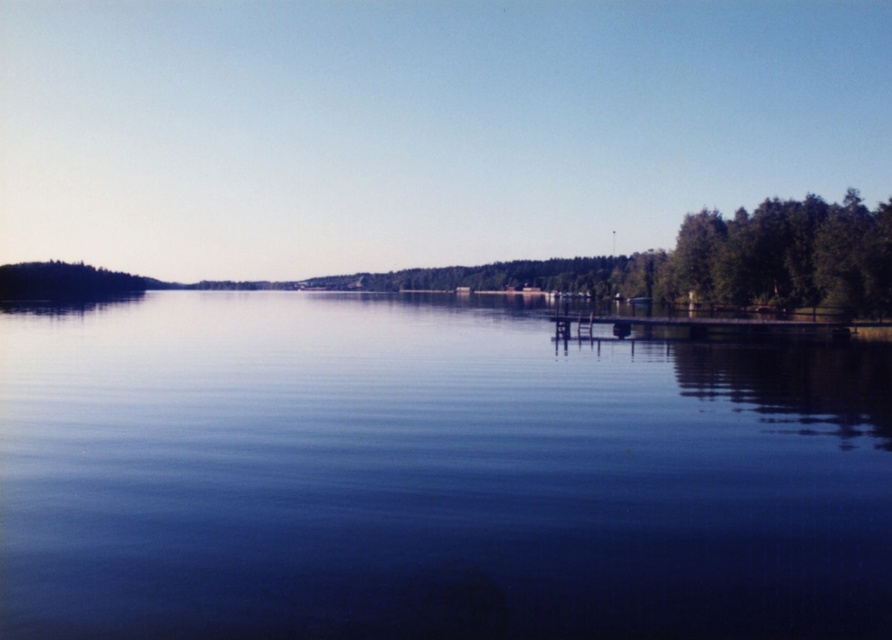
In the scene shown: You are a drone operator trying to capture the reflection of the wooden dock on the blue smooth water at center. According to the coordinates provided, where should you position the drone to best capture this reflection?

The blue smooth water at center is located at point (430, 476), so the drone should be positioned above that coordinate to capture the reflection of the wooden dock on the blue smooth water at center.

You are a kayaker planning to paddle from the wooden dock at right to the blue smooth water at center. Given that your kayak requires a minimum of 20 meters of open water to navigate safely, will you be able to make the journey without encountering any obstacles?

The distance between the wooden dock at right and the blue smooth water at center is 18.16 meters, which is less than the required 20 meters for safe navigation. Therefore, you may encounter obstacles or insufficient space during the journey.